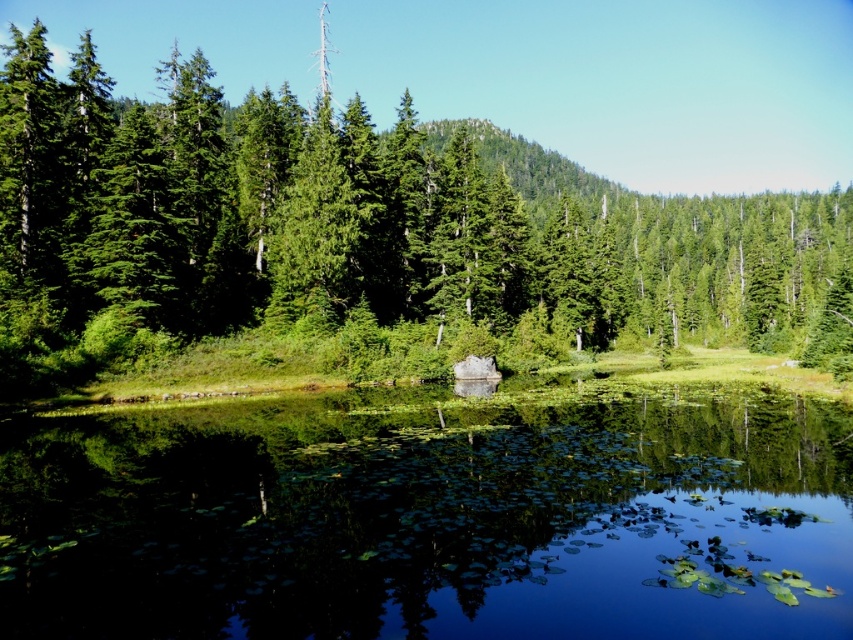
You are an environmental scientist assessing the ecological balance of this pond. You notice the green reflective water at center and the green matte tree at center. Which of these two elements occupies a larger area in the scene?

The green matte tree at center occupies a larger area in the scene than the green reflective water at center, as the green reflective water at center is described as smaller than the green matte tree at center.

You are standing at the edge of the pond and want to observe both the green reflective water at center and the green matte tree at center. Which one appears nearer to you?

The green reflective water at center appears nearer to you because it is closer to the viewer than the green matte tree at center.